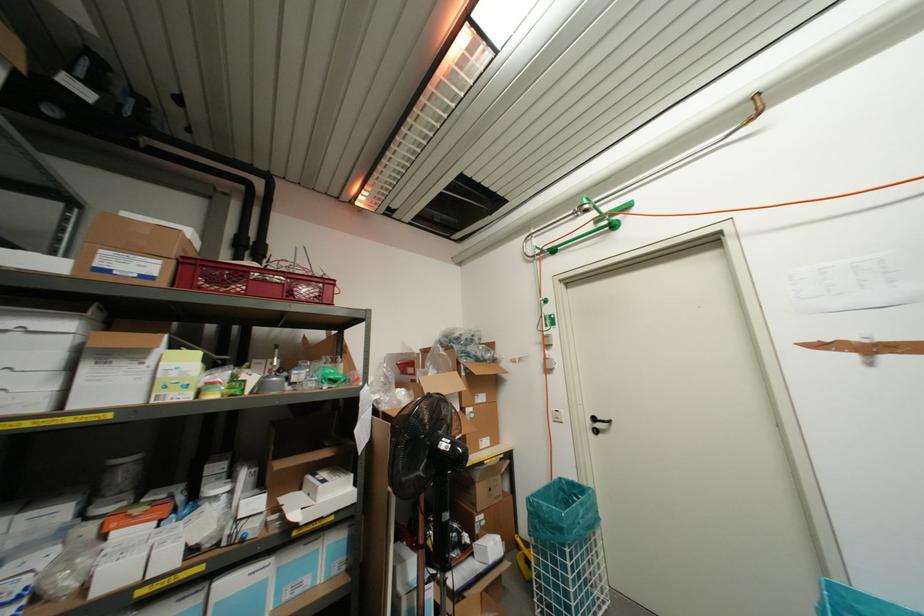
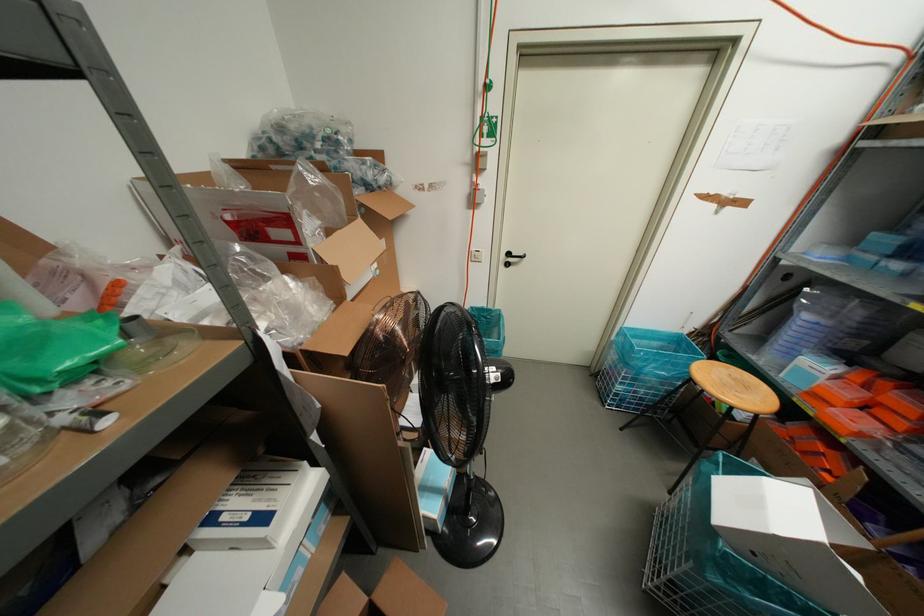
Locate, in the second image, the point that corresponds to point 594,431 in the first image.

(506, 264)